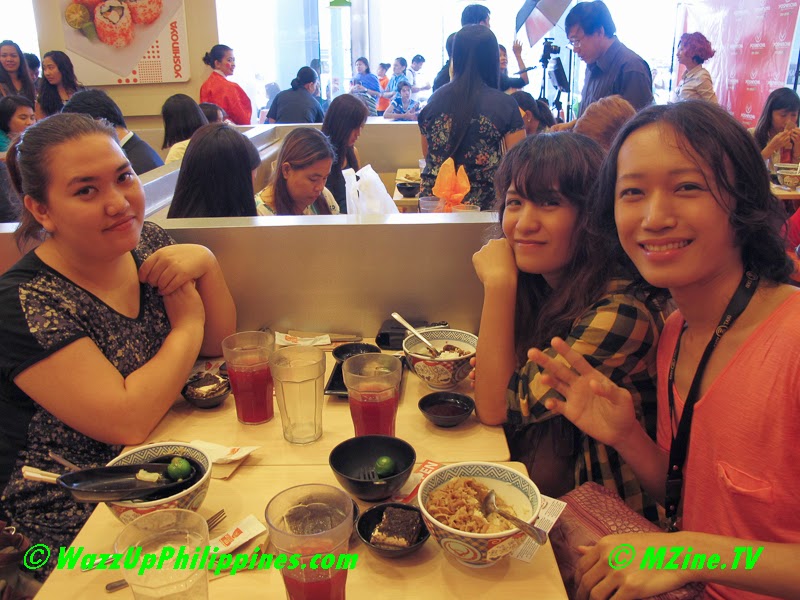
Find the location of `fork`. fork is located at coordinates (222, 518).